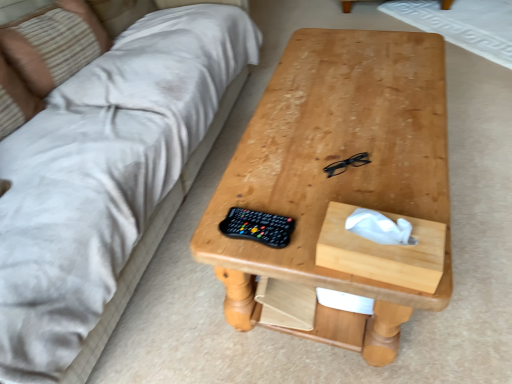
Measure the distance between wooden tissue box at center-right and camera.

wooden tissue box at center-right and camera are 84.02 centimeters apart.

What is the approximate height of wooden tissue box at center-right?

The height of wooden tissue box at center-right is 5.19 inches.

Locate an element on the screen. The width and height of the screenshot is (512, 384). black plastic glasses at center is located at coordinates (346, 164).

You are a GUI agent. You are given a task and a screenshot of the screen. Output one action in this format:
    pyautogui.click(x=<x>, y=<y>)
    Task: Click on the beige fabric couch at upper left
    The height and width of the screenshot is (384, 512).
    Given the screenshot: What is the action you would take?
    pyautogui.click(x=106, y=182)

This screenshot has width=512, height=384. I want to click on wooden tissue box at center-right, so click(x=382, y=252).

The height and width of the screenshot is (384, 512). Identify the location of studio couch on the left of wooden tissue box at center-right. (106, 182).

Does point (102, 190) appear closer or farther from the camera than point (431, 232)?

Point (102, 190) appears to be farther away from the viewer than point (431, 232).

Consider the image. Can you confirm if beige fabric couch at upper left is wider than wooden tissue box at center-right?

Yes, beige fabric couch at upper left is wider than wooden tissue box at center-right.

From a real-world perspective, is wooden tissue box at center-right positioned over black plastic glasses at center based on gravity?

Indeed, from a real-world perspective, wooden tissue box at center-right stands above black plastic glasses at center.

Choose the correct answer: Is wooden tissue box at center-right inside black plastic glasses at center or outside it?

wooden tissue box at center-right exists outside the volume of black plastic glasses at center.

Are wooden tissue box at center-right and black plastic glasses at center making contact?

No, wooden tissue box at center-right is not with black plastic glasses at center.

Which object is closer to the camera taking this photo, wooden tissue box at center-right or black plastic glasses at center?

wooden tissue box at center-right is in front.

Which point is more distant from viewer, (x=389, y=251) or (x=52, y=33)?

The point (x=52, y=33) is behind.

Is the position of wooden tissue box at center-right more distant than that of beige striped pillow at upper left?

No, it is not.

Can you confirm if wooden tissue box at center-right is thinner than beige striped pillow at upper left?

Yes, wooden tissue box at center-right is thinner than beige striped pillow at upper left.

Which is further, (328, 49) or (345, 165)?

The point (328, 49) is farther from the camera.

How different are the orientations of natural wood table at center and black plastic glasses at center in degrees?

The angle between the facing direction of natural wood table at center and the facing direction of black plastic glasses at center is 39.7 degrees.

Is the position of natural wood table at center more distant than that of black plastic glasses at center?

That is False.

From the image's perspective, is natural wood table at center under black plastic glasses at center?

Yes, from the image's perspective, natural wood table at center is below black plastic glasses at center.

Considering the relative sizes of beige fabric couch at upper left and beige striped pillow at upper left in the image provided, is beige fabric couch at upper left taller than beige striped pillow at upper left?

Incorrect, the height of beige fabric couch at upper left is not larger of that of beige striped pillow at upper left.

Based on their sizes in the image, would you say beige fabric couch at upper left is bigger or smaller than beige striped pillow at upper left?

In the image, beige fabric couch at upper left appears to be larger than beige striped pillow at upper left.

Consider the image. Is beige fabric couch at upper left far away from beige striped pillow at upper left?

That's not correct — beige fabric couch at upper left is a little close to beige striped pillow at upper left.

Considering the sizes of objects natural wood table at center and beige striped pillow at upper left in the image provided, who is bigger, natural wood table at center or beige striped pillow at upper left?

natural wood table at center.

Between point (242, 300) and point (4, 39), which one is positioned behind?

The point (4, 39) is behind.

From a real-world perspective, is natural wood table at center physically located above or below beige striped pillow at upper left?

Clearly, from a real-world perspective, natural wood table at center is below beige striped pillow at upper left.

Would you say natural wood table at center is outside beige striped pillow at upper left?

Absolutely, natural wood table at center is external to beige striped pillow at upper left.

Are black plastic glasses at center and beige fabric couch at upper left making contact?

black plastic glasses at center and beige fabric couch at upper left are not in contact.

At what (x,y) coordinates should I click in order to perform the action: click on glasses on the right side of beige fabric couch at upper left. Please return your answer as a coordinate pair (x, y). Image resolution: width=512 pixels, height=384 pixels. Looking at the image, I should click on (346, 164).

Is black plastic glasses at center outside of beige fabric couch at upper left?

Yes, black plastic glasses at center is outside of beige fabric couch at upper left.

From the image's perspective, is black plastic glasses at center located above or below beige fabric couch at upper left?

Clearly, from the image's perspective, black plastic glasses at center is below beige fabric couch at upper left.

Locate an element on the screen. The height and width of the screenshot is (384, 512). studio couch behind the wooden tissue box at center-right is located at coordinates (106, 182).

The image size is (512, 384). I want to click on glasses located above the wooden tissue box at center-right (from the image's perspective), so click(346, 164).

When comparing their distances from natural wood table at center, does beige fabric couch at upper left or black plastic glasses at center seem further?

beige fabric couch at upper left is positioned further to the anchor natural wood table at center.

Estimate the real-world distances between objects in this image. Which object is closer to natural wood table at center, beige fabric couch at upper left or beige striped pillow at upper left?

Based on the image, beige fabric couch at upper left appears to be nearer to natural wood table at center.

Looking at the image, which one is located further to wooden tissue box at center-right, natural wood table at center or beige fabric couch at upper left?

beige fabric couch at upper left lies further to wooden tissue box at center-right than the other object.

When comparing their distances from black plastic glasses at center, does beige striped pillow at upper left or natural wood table at center seem closer?

natural wood table at center is closer to black plastic glasses at center.

Considering their positions, is beige fabric couch at upper left positioned further to beige striped pillow at upper left than wooden tissue box at center-right?

wooden tissue box at center-right is further to beige striped pillow at upper left.

Looking at the image, which one is located closer to wooden tissue box at center-right, beige striped pillow at upper left or beige fabric couch at upper left?

beige fabric couch at upper left is positioned closer to the anchor wooden tissue box at center-right.

Which object lies further to the anchor point black plastic glasses at center, natural wood table at center or beige fabric couch at upper left?

Among the two, beige fabric couch at upper left is located further to black plastic glasses at center.

Which object lies further to the anchor point beige fabric couch at upper left, black plastic glasses at center or wooden tissue box at center-right?

The object further to beige fabric couch at upper left is wooden tissue box at center-right.

Locate an element on the screen. Image resolution: width=512 pixels, height=384 pixels. glasses between beige striped pillow at upper left and wooden tissue box at center-right from left to right is located at coordinates (346, 164).

Identify the location of table between beige fabric couch at upper left and wooden tissue box at center-right from top to bottom. (337, 176).

Where is `glasses between beige striped pillow at upper left and natural wood table at center`? Image resolution: width=512 pixels, height=384 pixels. glasses between beige striped pillow at upper left and natural wood table at center is located at coordinates (346, 164).

The height and width of the screenshot is (384, 512). I want to click on glasses that lies between beige fabric couch at upper left and wooden tissue box at center-right from top to bottom, so click(x=346, y=164).